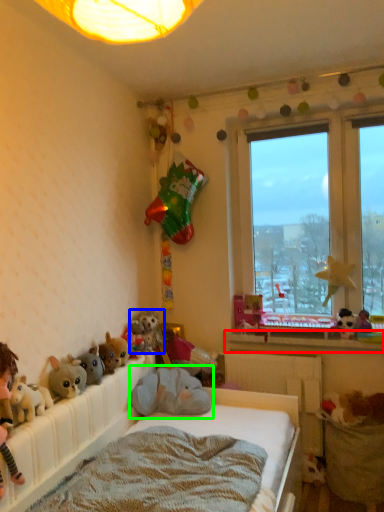
Question: Which object is the closest to the window sill (highlighted by a red box)? Choose among these: toy (highlighted by a blue box) or toy (highlighted by a green box).

Choices:
 (A) toy
 (B) toy

Answer: (B)